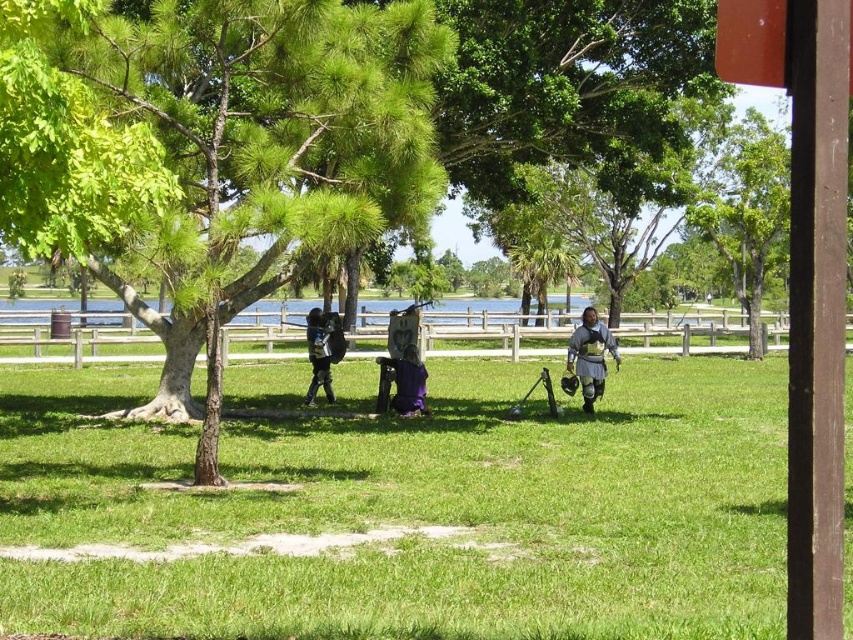
The height and width of the screenshot is (640, 853). Describe the element at coordinates (418, 509) in the screenshot. I see `green grassy field at center` at that location.

Is green grassy field at center to the right of green leafy tree at center from the viewer's perspective?

Correct, you'll find green grassy field at center to the right of green leafy tree at center.

You are a GUI agent. You are given a task and a screenshot of the screen. Output one action in this format:
    pyautogui.click(x=<x>, y=<y>)
    Task: Click on the green grassy field at center
    The height and width of the screenshot is (640, 853).
    Given the screenshot: What is the action you would take?
    pyautogui.click(x=418, y=509)

Can you confirm if green leafy tree at center is thinner than shiny black armor at center?

No, green leafy tree at center is not thinner than shiny black armor at center.

Can you confirm if green leafy tree at center is positioned to the left of shiny black armor at center?

In fact, green leafy tree at center is to the right of shiny black armor at center.

Identify the location of green leafy tree at center. Image resolution: width=853 pixels, height=640 pixels. (212, 150).

I want to click on green leafy tree at center, so coord(212,150).

Between shiny silver armor at center and shiny black armor at center, which one has more height?

With more height is shiny silver armor at center.

Is point (578, 332) in front of point (318, 321)?

Yes, it is.

Between point (572, 356) and point (328, 316), which one is positioned behind?

Point (328, 316)

At what (x,y) coordinates should I click in order to perform the action: click on shiny silver armor at center. Please return your answer as a coordinate pair (x, y). Looking at the image, I should click on (590, 356).